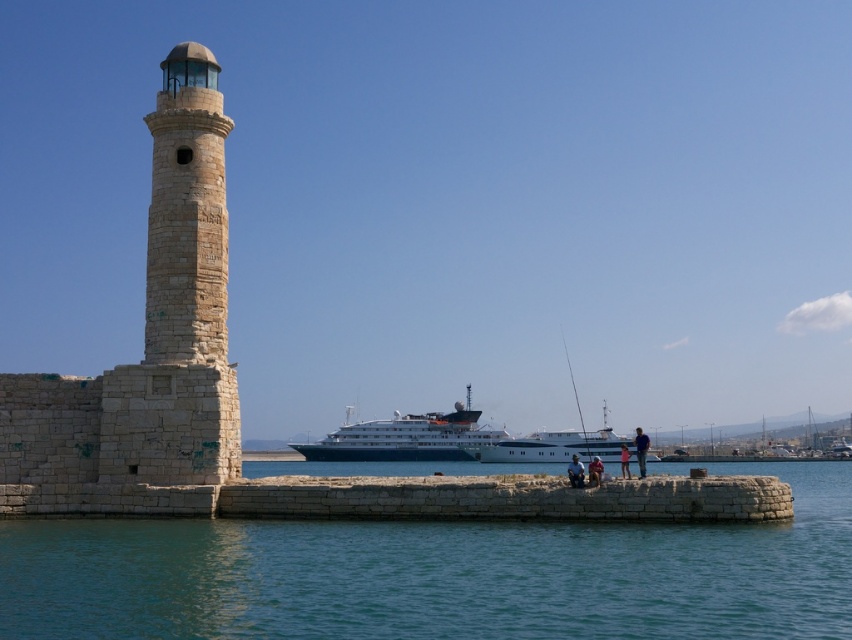
You are standing on the pier and want to take a photo of both the stone lighthouse at left and the blue denim jeans at center. Which object should you zoom in on first to ensure both fit in the frame?

You should zoom in on the stone lighthouse at left first since it is smaller in size compared to the blue denim jeans at center, allowing both to fit within the camera frame.

You are standing on the pier and see the white glossy cruise ship at center and the blue denim jeans at center. Which object is closer to the water?

The white glossy cruise ship at center is positioned under the blue denim jeans at center, so the white glossy cruise ship at center is closer to the water.